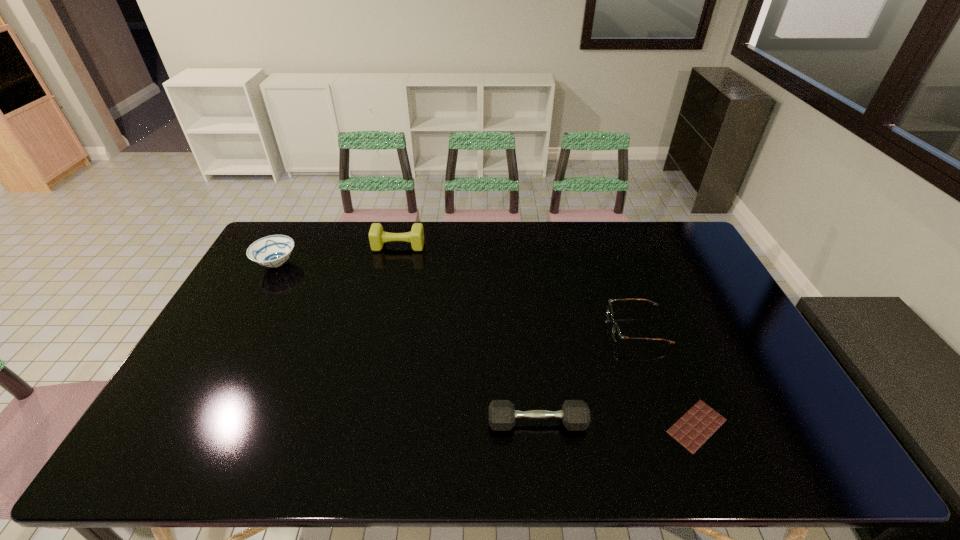
Locate an element on the screen. The height and width of the screenshot is (540, 960). blank region between the farther dumbbell and the leftmost object is located at coordinates (338, 255).

What are the coordinates of `free spot between the nearer dumbbell and the shortest object` in the screenshot? It's located at (617, 424).

Where is `free area in between the right dumbbell and the chocolate bar`? free area in between the right dumbbell and the chocolate bar is located at coordinates (617, 424).

Locate an element on the screen. The width and height of the screenshot is (960, 540). free space between the farther dumbbell and the fourth tallest object is located at coordinates (517, 287).

Find the location of a particular element. This screenshot has height=540, width=960. free area in between the chocolate bar and the farther dumbbell is located at coordinates (547, 336).

You are a GUI agent. You are given a task and a screenshot of the screen. Output one action in this format:
    pyautogui.click(x=<x>, y=<y>)
    Task: Click on the vacant region between the soup bowl and the chocolate bar
    The width and height of the screenshot is (960, 540).
    Given the screenshot: What is the action you would take?
    pyautogui.click(x=487, y=345)

Locate an element on the screen. The width and height of the screenshot is (960, 540). vacant area between the second object from left to right and the shortest object is located at coordinates (547, 336).

This screenshot has width=960, height=540. In order to click on free point between the spectacles and the taller dumbbell in this screenshot , I will do click(x=517, y=287).

Identify which object is the second closest to the right dumbbell. Please provide its 2D coordinates. Your answer should be formatted as a tuple, i.e. [(x, y)], where the tuple contains the x and y coordinates of a point satisfying the conditions above.

[(616, 333)]

Find the location of a particular element. object that is the closest to the soup bowl is located at coordinates (377, 237).